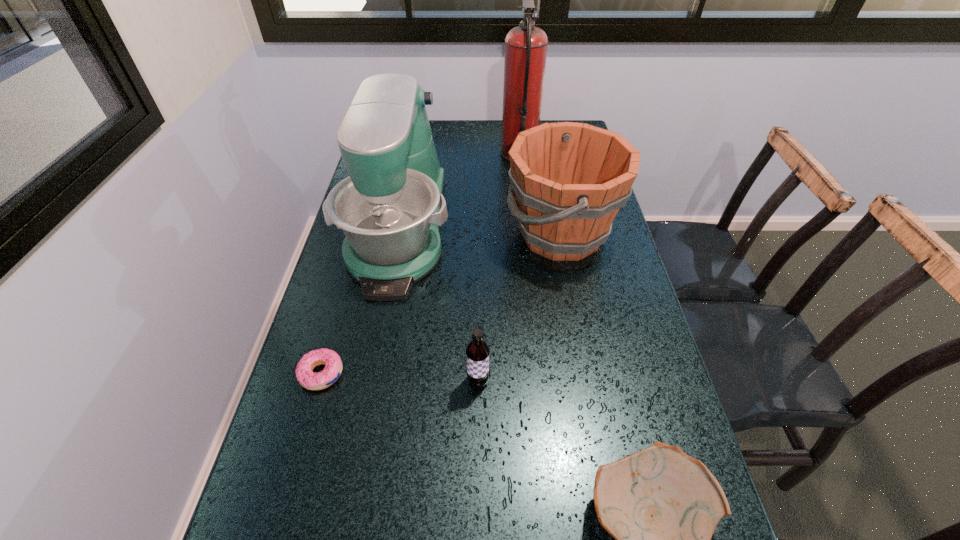
The image size is (960, 540). Identify the location of the tallest object. (526, 45).

This screenshot has height=540, width=960. I want to click on fire extinguisher, so click(x=526, y=45).

Find the location of `the fifth shortest object`. the fifth shortest object is located at coordinates (390, 208).

Identify the location of the fourth shortest object. This screenshot has height=540, width=960. (570, 179).

The width and height of the screenshot is (960, 540). Identify the location of the fourth tallest object. (477, 352).

Find the location of a particular element. the fourth object from right to left is located at coordinates click(477, 352).

The image size is (960, 540). What are the coordinates of `the shortest object` in the screenshot? It's located at (307, 378).

Where is `vacant space located at the nozzle of the farthest object`? The image size is (960, 540). vacant space located at the nozzle of the farthest object is located at coordinates (391, 154).

Identify the location of vacant position located 0.160m at the nozzle of the farthest object. (456, 154).

Find the location of `blank space located 0.300m at the nozzle of the farthest object`. blank space located 0.300m at the nozzle of the farthest object is located at coordinates (416, 154).